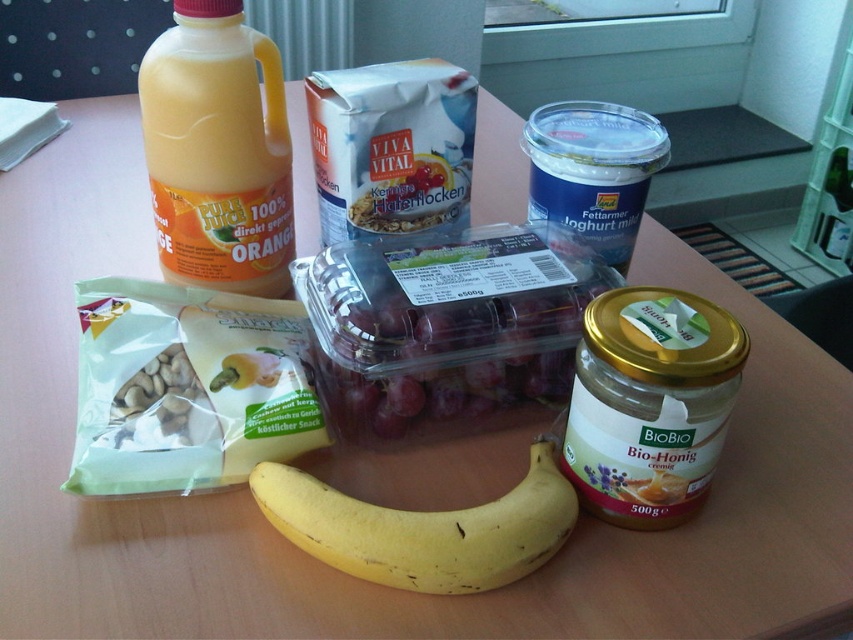
Question: Among these points, which one is farthest from the camera?

Choices:
 (A) (351, 515)
 (B) (183, 438)
 (C) (183, 170)

Answer: (C)

Question: Which object is positioned farthest from the purple translucent grapes at center?

Choices:
 (A) white matte nuts at center-left
 (B) matte plastic bottle of orange juice at upper left
 (C) blue plastic yogurt at upper center
 (D) yellow matte banana at center

Answer: (A)

Question: Does matte plastic bottle of orange juice at upper left have a larger size compared to white matte nuts at center-left?

Choices:
 (A) no
 (B) yes

Answer: (B)

Question: Which of the following is the closest to the observer?

Choices:
 (A) (532, 500)
 (B) (244, 28)

Answer: (A)

Question: Is purple translucent grapes at center to the right of matte plastic bottle of orange juice at upper left from the viewer's perspective?

Choices:
 (A) yes
 (B) no

Answer: (A)

Question: Is matte plastic bottle of orange juice at upper left below white matte nuts at center-left?

Choices:
 (A) no
 (B) yes

Answer: (A)